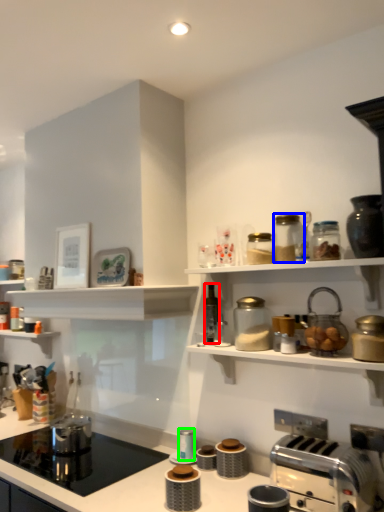
Question: Considering the real-world distances, which object is farthest from bottle (highlighted by a red box)? glass jar (highlighted by a blue box) or appliance (highlighted by a green box)?

Choices:
 (A) glass jar
 (B) appliance

Answer: (B)